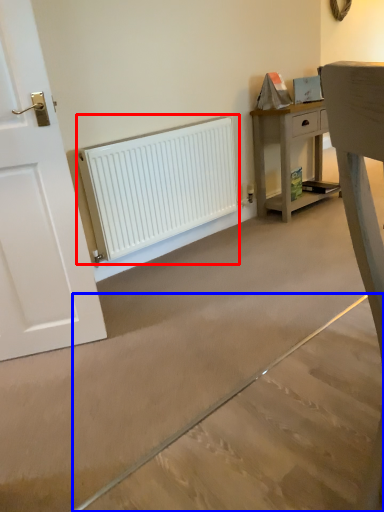
Question: Which object is closer to the camera taking this photo, radiator (highlighted by a red box) or concrete (highlighted by a blue box)?

Choices:
 (A) radiator
 (B) concrete

Answer: (B)